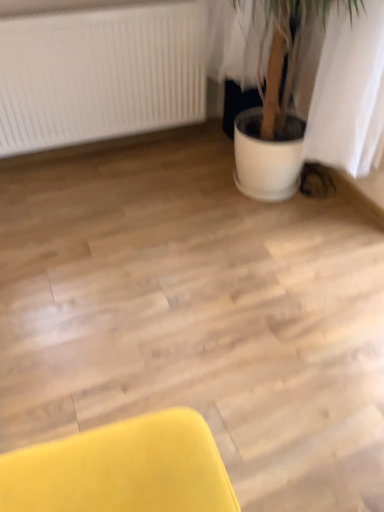
This screenshot has width=384, height=512. Describe the element at coordinates (99, 75) in the screenshot. I see `white textured radiator at upper left` at that location.

What is the approximate width of white textured radiator at upper left?

5.89 inches.

You are a GUI agent. You are given a task and a screenshot of the screen. Output one action in this format:
    pyautogui.click(x=<x>, y=<y>)
    Task: Click on the white textured radiator at upper left
    
    Given the screenshot: What is the action you would take?
    pyautogui.click(x=99, y=75)

At what (x,y) coordinates should I click in order to perform the action: click on white textured radiator at upper left. Please return your answer as a coordinate pair (x, y). Image resolution: width=384 pixels, height=512 pixels. Looking at the image, I should click on (99, 75).